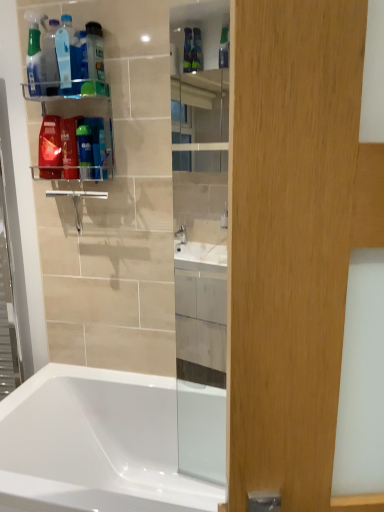
The width and height of the screenshot is (384, 512). Identify the location of free spot below clear plastic shelf at upper left (from a real-world perspective). (90, 372).